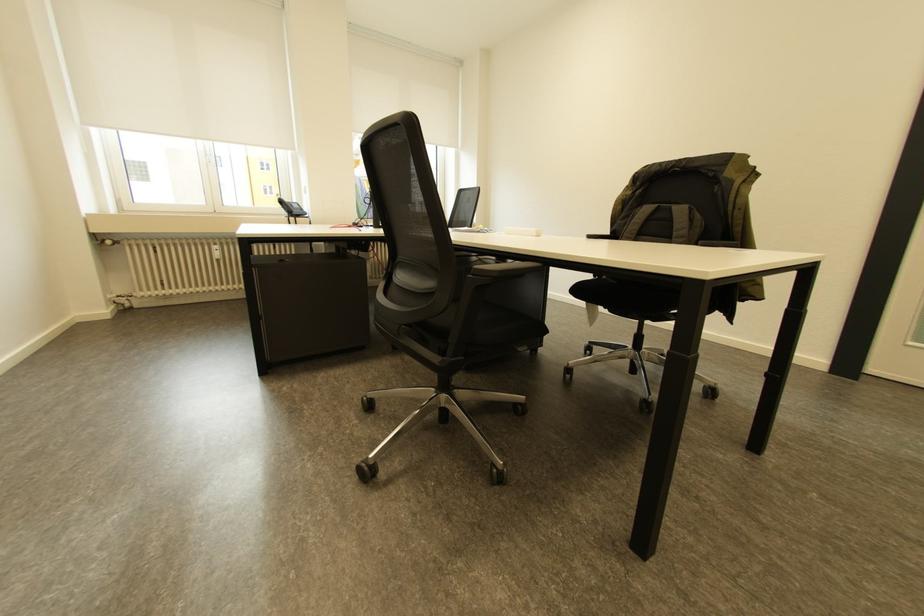
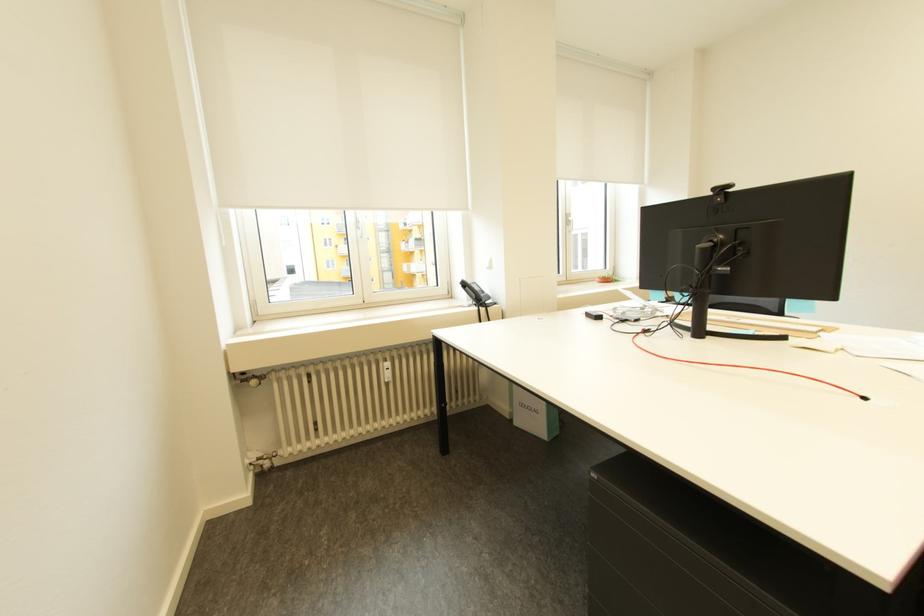
In a continuous first-person perspective shot, in which direction is the camera moving?

The cameraman moved toward left, forward.